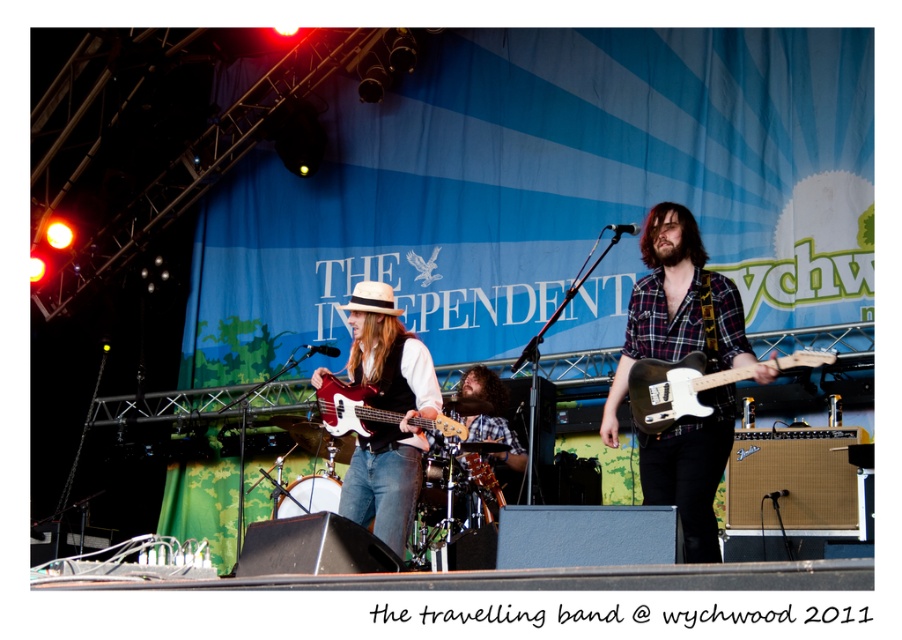
You are a photographer at the Wychwood performance in 2011. You want to take a photo of the stage with both the drum set and the amplifiers visible. The drum set is located at point (391, 352) and the amplifiers are at point (325, 412). From which point should you position yourself to ensure both are in frame without any obstruction?

You should position yourself at point (325, 412) because point (391, 352) is behind it, so placing yourself at the front point will allow both the drum set and amplifiers to be visible without obstruction.